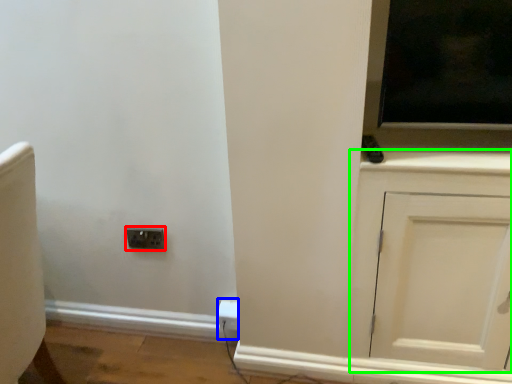
Question: Which object is the closest to the socket (highlighted by a red box)? Choose among these: electric outlet (highlighted by a blue box) or cabinetry (highlighted by a green box).

Choices:
 (A) electric outlet
 (B) cabinetry

Answer: (A)